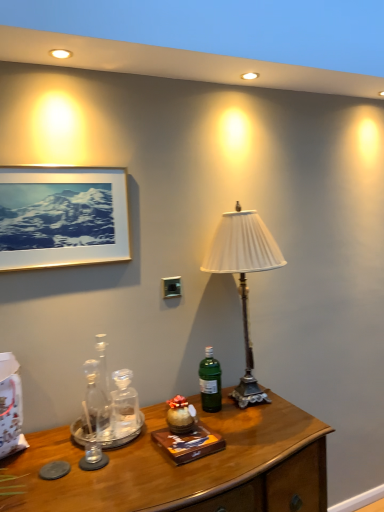
Where is `free location in front of white pleated fabric lampshade at center`? This screenshot has width=384, height=512. free location in front of white pleated fabric lampshade at center is located at coordinates (269, 437).